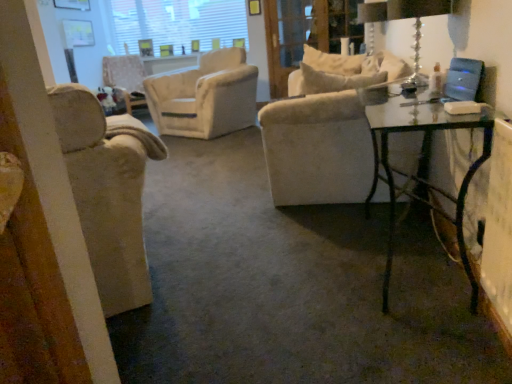
Question: From a real-world perspective, does clear glass screen door at upper center sit lower than velvet beige armchair at center, marked as the first chair in a top-to-bottom arrangement?

Choices:
 (A) yes
 (B) no

Answer: (B)

Question: From the image's perspective, is clear glass screen door at upper center beneath velvet beige armchair at center, which is the 2th chair in right-to-left order?

Choices:
 (A) yes
 (B) no

Answer: (B)

Question: Is clear glass screen door at upper center facing away from velvet beige armchair at center, which ranks as the 2th chair in bottom-to-top order?

Choices:
 (A) no
 (B) yes

Answer: (A)

Question: Is velvet beige armchair at center, which ranks as the first chair in back-to-front order, a part of clear glass screen door at upper center?

Choices:
 (A) yes
 (B) no

Answer: (B)

Question: Can you confirm if clear glass screen door at upper center is bigger than velvet beige armchair at center, which ranks as the 2th chair in bottom-to-top order?

Choices:
 (A) yes
 (B) no

Answer: (B)

Question: Is transparent glass table at right situated inside white textured window screen at upper center or outside?

Choices:
 (A) outside
 (B) inside

Answer: (A)

Question: From a real-world perspective, is transparent glass table at right positioned above or below white textured window screen at upper center?

Choices:
 (A) below
 (B) above

Answer: (A)

Question: Relative to white textured window screen at upper center, is transparent glass table at right in front or behind?

Choices:
 (A) behind
 (B) front

Answer: (B)

Question: Would you say transparent glass table at right is to the left or to the right of white textured window screen at upper center in the picture?

Choices:
 (A) right
 (B) left

Answer: (A)

Question: Considering the positions of white textured window screen at upper center and transparent glass table at right in the image, is white textured window screen at upper center wider or thinner than transparent glass table at right?

Choices:
 (A) thin
 (B) wide

Answer: (A)

Question: From the image's perspective, relative to transparent glass table at right, is white textured window screen at upper center above or below?

Choices:
 (A) below
 (B) above

Answer: (B)

Question: Is white textured window screen at upper center situated inside transparent glass table at right or outside?

Choices:
 (A) outside
 (B) inside

Answer: (A)

Question: Considering their positions, is white textured window screen at upper center located in front of or behind transparent glass table at right?

Choices:
 (A) behind
 (B) front

Answer: (A)

Question: In terms of width, does velvet beige armchair at center, marked as the first chair in a top-to-bottom arrangement, look wider or thinner when compared to white textured window screen at upper center?

Choices:
 (A) thin
 (B) wide

Answer: (B)

Question: Is velvet beige armchair at center, positioned as the 2th chair in front-to-back order, in front of or behind white textured window screen at upper center in the image?

Choices:
 (A) behind
 (B) front

Answer: (B)